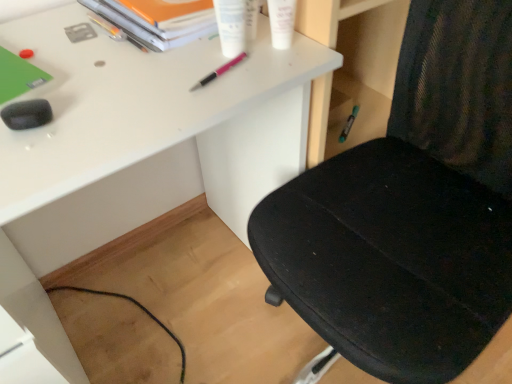
This screenshot has height=384, width=512. I want to click on vacant space that is to the left of white plastic tubes at upper center, which is counted as the third stationery, starting from the right, so click(137, 60).